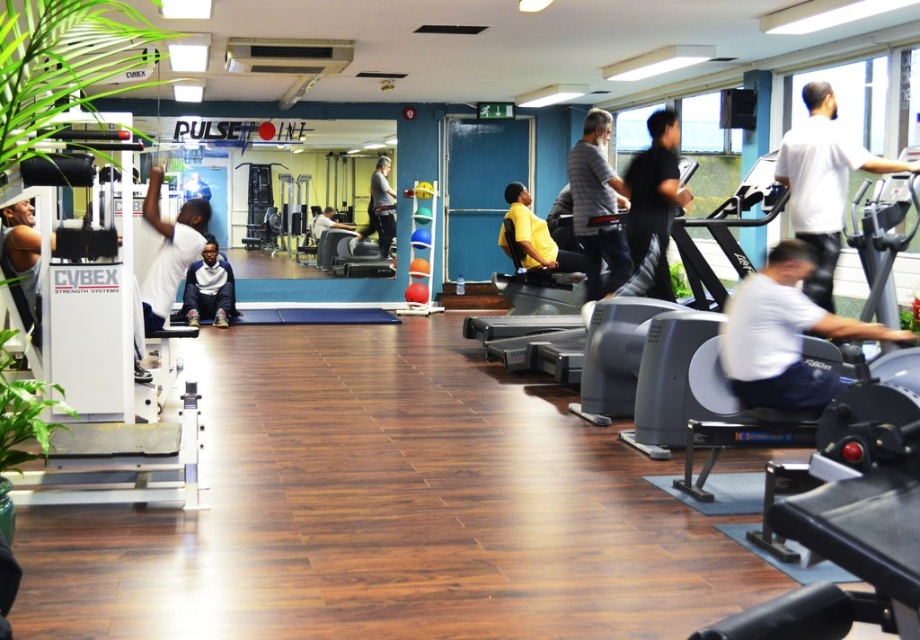
You are a gym trainer who wants to organize the clothing items in the gym. You see a gray cotton shirt at center and a dark gray sweater at center. Which clothing item is located to the right of the other?

The gray cotton shirt at center is positioned on the right side of dark gray sweater at center.

Consider the image. You are a gym trainer standing in the middle of the gym. You need to adjust the white matte shirt at right and the yellow matte chair at center. Based on their positions, which object is higher up?

The white matte shirt at right is above the yellow matte chair at center, so the white matte shirt at right is higher up.

You are standing in the gym and see the white matte shirt at right and the yellow matte chair at center. Which object is nearer to you?

The white matte shirt at right is closer to the viewer than the yellow matte chair at center.